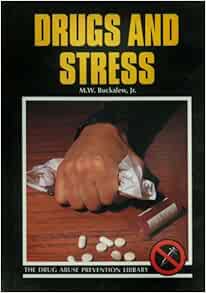
Find the location of a particular element. poster edges is located at coordinates (52, 101), (193, 165), (31, 153), (123, 274), (129, 265), (202, 159), (6, 144), (111, 286), (110, 6).